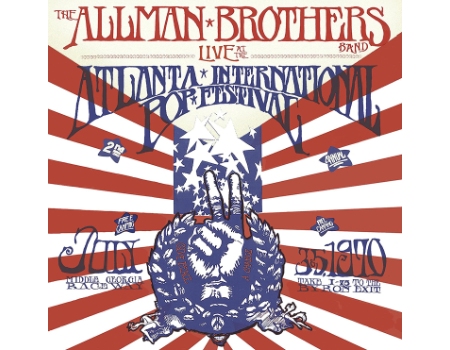
This screenshot has width=450, height=350. I want to click on poster, so click(213, 129).